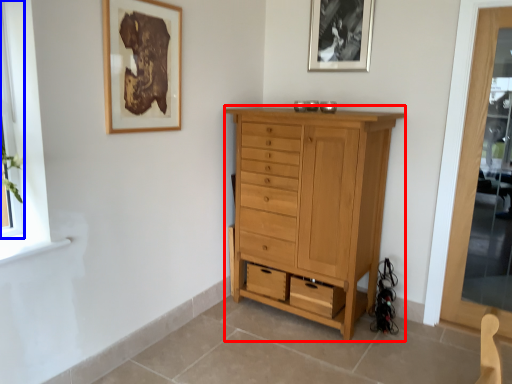
Question: Which object is further to the camera taking this photo, chest of drawers (highlighted by a red box) or window (highlighted by a blue box)?

Choices:
 (A) chest of drawers
 (B) window

Answer: (A)